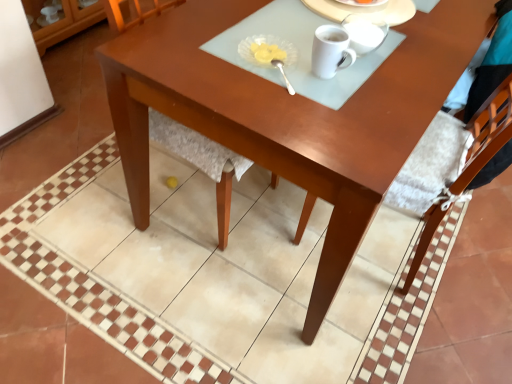
At what (x,y) coordinates should I click in order to perform the action: click on vacant region to the left of wooden chair at center. Please return your answer as a coordinate pair (x, y). Looking at the image, I should click on (72, 182).